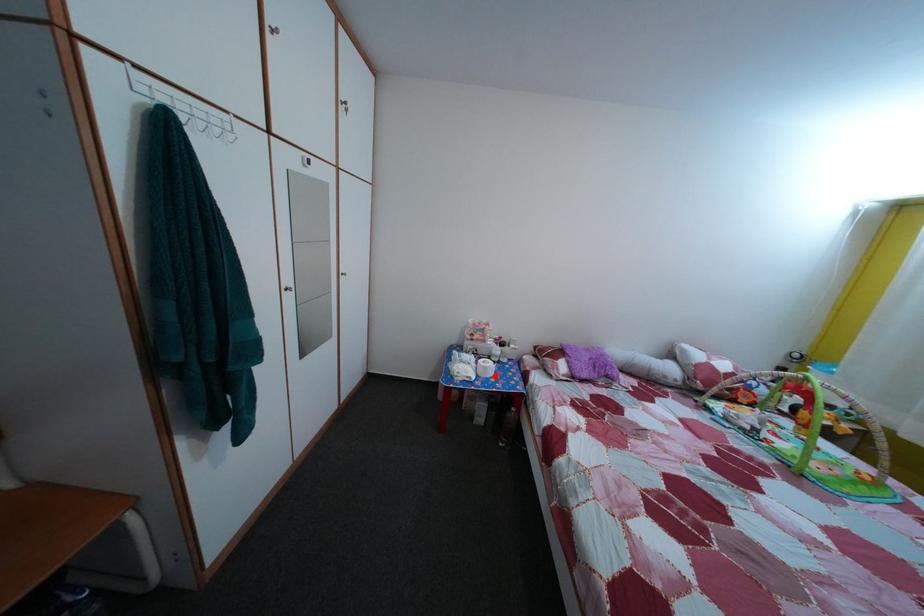
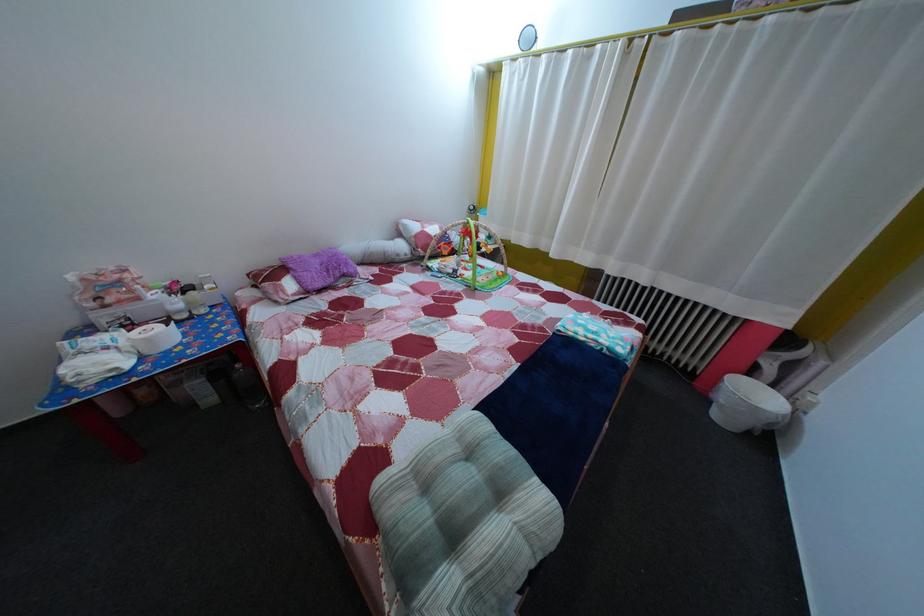
The point at the highlighted location is marked in the first image. Where is the corresponding point in the second image?

(157, 347)